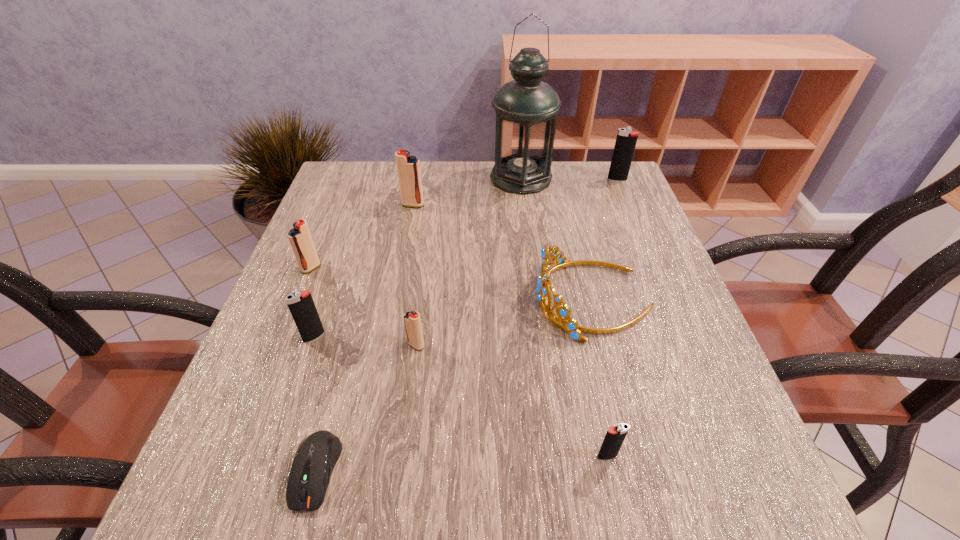
Where is `the tallest object`? This screenshot has width=960, height=540. the tallest object is located at coordinates (526, 108).

The height and width of the screenshot is (540, 960). Find the location of `oil lamp`. oil lamp is located at coordinates (526, 108).

In order to click on the second farthest igniter in this screenshot , I will do `click(408, 167)`.

Where is `the second red igniter from right to left`? The height and width of the screenshot is (540, 960). the second red igniter from right to left is located at coordinates (408, 167).

Identify the location of the rightmost black igniter. The image size is (960, 540). (626, 139).

In order to click on the farthest igniter in this screenshot , I will do `click(626, 139)`.

This screenshot has height=540, width=960. I want to click on tiara, so click(x=571, y=326).

Identify the location of the second object from left to right. This screenshot has height=540, width=960. (301, 305).

The height and width of the screenshot is (540, 960). Find the location of `the second nearest black igniter`. the second nearest black igniter is located at coordinates (301, 305).

You are a GUI agent. You are given a task and a screenshot of the screen. Output one action in this format:
    pyautogui.click(x=<x>, y=<y>)
    Task: Click on the leftmost igniter
    The width and height of the screenshot is (960, 540).
    Given the screenshot: What is the action you would take?
    pyautogui.click(x=300, y=238)